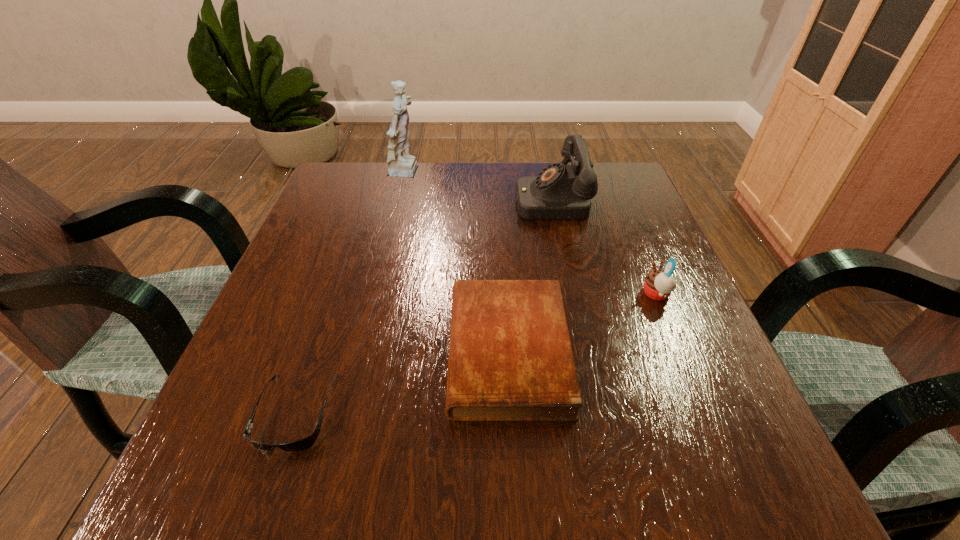
This screenshot has height=540, width=960. What are the coordinates of `free space between the third tallest object and the figurine` in the screenshot? It's located at (532, 234).

This screenshot has height=540, width=960. What are the coordinates of `free spot between the tallest object and the third tallest object` in the screenshot? It's located at (532, 234).

I want to click on empty location between the muffin and the Bible, so click(x=582, y=322).

You are a GUI agent. You are given a task and a screenshot of the screen. Output one action in this format:
    pyautogui.click(x=<x>, y=<y>)
    Task: Click on the vacant space in between the second tallest object and the rightmost object
    
    Given the screenshot: What is the action you would take?
    pyautogui.click(x=603, y=246)

Where is `vacant area that lies between the sunglasses and the fourth shortest object`? vacant area that lies between the sunglasses and the fourth shortest object is located at coordinates (422, 306).

I want to click on free point between the third tallest object and the second shortest object, so click(582, 322).

You are a GUI agent. You are given a task and a screenshot of the screen. Output one action in this format:
    pyautogui.click(x=<x>, y=<y>)
    Task: Click on the free space between the telephone and the fourth tallest object
    The height and width of the screenshot is (540, 960).
    Given the screenshot: What is the action you would take?
    pyautogui.click(x=529, y=275)

Locate an element on the screen. blank region between the telephone and the sunglasses is located at coordinates (422, 306).

Locate an element on the screen. empty location between the telephone and the sunglasses is located at coordinates (422, 306).

Find the location of a particular element. vacant region between the telephone and the Bible is located at coordinates (529, 275).